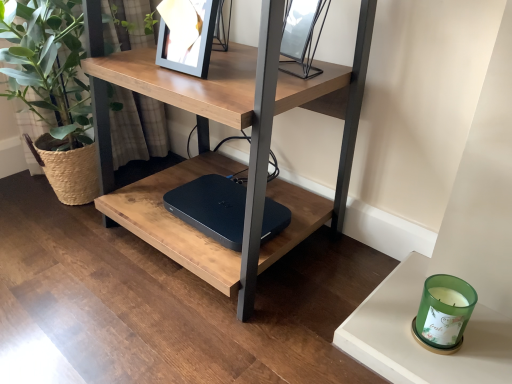
Identify the location of free region on the left part of matte wood table at center. This screenshot has width=512, height=384. (61, 266).